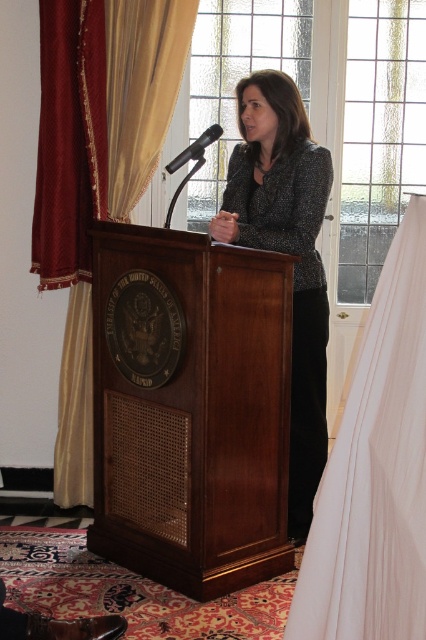
Question: Which of the following is the farthest from the observer?

Choices:
 (A) silky gold curtain at left
 (B) mahogany wood podium at center

Answer: (A)

Question: Among these objects, which one is nearest to the camera?

Choices:
 (A) silky gold curtain at left
 (B) white fabric at right

Answer: (B)

Question: Which point is closer to the camera?

Choices:
 (A) (391, 326)
 (B) (167, 81)
 (C) (322, 445)

Answer: (A)

Question: Is white fabric at right to the left of silky gold curtain at left from the viewer's perspective?

Choices:
 (A) yes
 (B) no

Answer: (B)

Question: Does white fabric at right appear under black textured blazer at center?

Choices:
 (A) no
 (B) yes

Answer: (B)

Question: Does mahogany wood podium at center have a larger size compared to black metallic microphone at center?

Choices:
 (A) no
 (B) yes

Answer: (B)